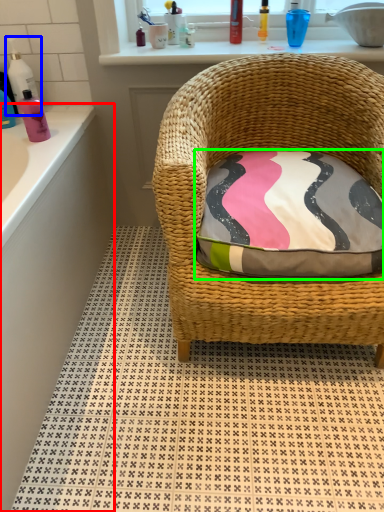
Question: Estimate the real-world distances between objects in this image. Which object is farther from bath (highlighted by a red box), cleaning product (highlighted by a blue box) or pillow (highlighted by a green box)?

Choices:
 (A) cleaning product
 (B) pillow

Answer: (B)